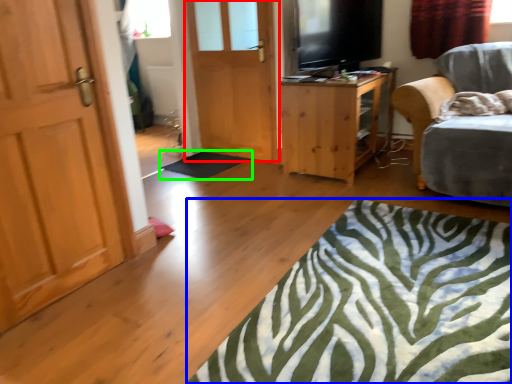
Question: Considering the real-world distances, which object is closest to door (highlighted by a red box)? plain (highlighted by a blue box) or flat (highlighted by a green box).

Choices:
 (A) plain
 (B) flat

Answer: (B)